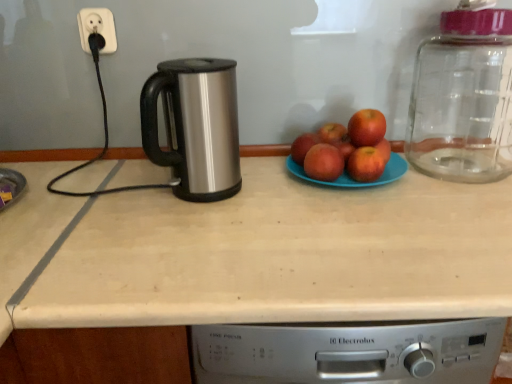
Locate an element on the screen. The width and height of the screenshot is (512, 384). free space in front of polished stainless steel kettle at center is located at coordinates (194, 233).